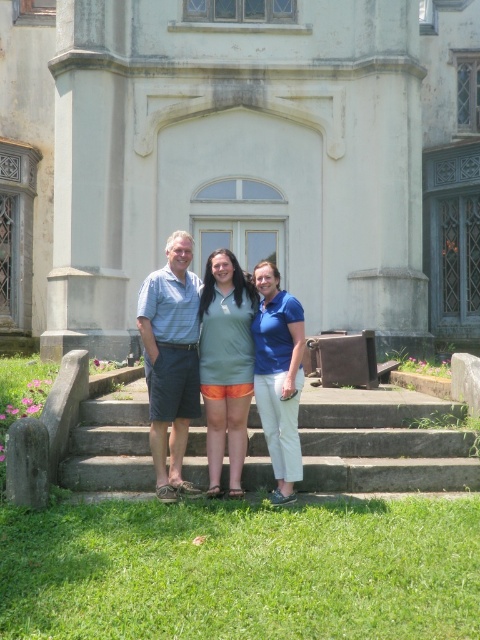
Is point (156, 285) positioned behind point (201, 316)?

That is False.

Is the position of light blue striped shirt at center less distant than that of green matte dress at center?

That is True.

I want to click on light blue striped shirt at center, so click(x=170, y=360).

Locate an element on the screen. light blue striped shirt at center is located at coordinates (170, 360).

Does matte blue shirt at center appear over light blue striped shirt at center?

Actually, matte blue shirt at center is below light blue striped shirt at center.

Identify the location of matte blue shirt at center. This screenshot has height=640, width=480. (199, 360).

Where is `matte blue shirt at center`? Image resolution: width=480 pixels, height=640 pixels. matte blue shirt at center is located at coordinates (199, 360).

Between gray concrete stairs at center and matte blue shirt at center, which one appears on the left side from the viewer's perspective?

matte blue shirt at center

Does gray concrete stairs at center have a lesser height compared to matte blue shirt at center?

Correct, gray concrete stairs at center is not as tall as matte blue shirt at center.

Is point (116, 440) positioned behind point (211, 340)?

Yes, point (116, 440) is farther from viewer.

The image size is (480, 640). What are the coordinates of `gray concrete stairs at center` in the screenshot? It's located at (384, 449).